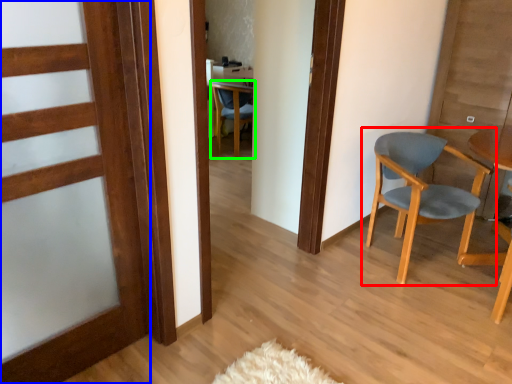
Question: Which object is the closest to the chair (highlighted by a red box)? Choose among these: door (highlighted by a blue box) or chair (highlighted by a green box).

Choices:
 (A) door
 (B) chair

Answer: (A)